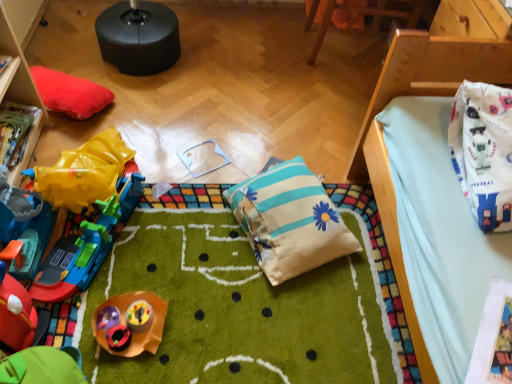
Measure the distance between rubberized yellow toy train at left, positioned as the 3th toy in bottom-to-top order, and camera.

A distance of 3.84 feet exists between rubberized yellow toy train at left, positioned as the 3th toy in bottom-to-top order, and camera.

Describe the element at coordinates (290, 221) in the screenshot. I see `striped cotton pillow at center` at that location.

In order to face white fabric bag at upper right, should I rotate leftwards or rightwards?

To face it directly, rotate right by 31.238 degrees.

Identify the location of white fabric bag at upper right. The width and height of the screenshot is (512, 384). (484, 151).

The height and width of the screenshot is (384, 512). What do you see at coordinates (15, 307) in the screenshot?
I see `rubberized green toy car at lower left, the second toy viewed from the top` at bounding box center [15, 307].

What do you see at coordinates (430, 74) in the screenshot?
I see `white fabric at upper right, positioned as the 3th furniture in left-to-right order` at bounding box center [430, 74].

Where is `wooden toy train at left, marked as the 3th furniture in a right-to-left arrangement`? wooden toy train at left, marked as the 3th furniture in a right-to-left arrangement is located at coordinates [19, 89].

From a real-world perspective, between white fabric at upper right, placed as the first furniture when sorted from right to left, and wooden chair at upper center, the 2th furniture positioned from the left, who is vertically lower?

wooden chair at upper center, the 2th furniture positioned from the left, from a real-world perspective.

Consider the image. Is white fabric at upper right, positioned as the 3th furniture in left-to-right order, oriented towards wooden chair at upper center, the 2th furniture positioned from the left?

Yes, white fabric at upper right, positioned as the 3th furniture in left-to-right order, is facing wooden chair at upper center, the 2th furniture positioned from the left.

Is the depth of white fabric at upper right, placed as the first furniture when sorted from right to left, less than that of wooden chair at upper center, acting as the second furniture starting from the right?

Yes, it is in front of wooden chair at upper center, acting as the second furniture starting from the right.

Does white fabric at upper right, positioned as the 3th furniture in left-to-right order, have a lesser width compared to wooden chair at upper center, the 2th furniture positioned from the left?

In fact, white fabric at upper right, positioned as the 3th furniture in left-to-right order, might be wider than wooden chair at upper center, the 2th furniture positioned from the left.

Locate an element on the screen. The width and height of the screenshot is (512, 384). the 1st furniture counting from the left side of the white fabric bag at upper right is located at coordinates (366, 14).

Consider the image. From the image's perspective, relative to white fabric bag at upper right, is wooden chair at upper center, acting as the second furniture starting from the right, above or below?

Clearly, from the image's perspective, wooden chair at upper center, acting as the second furniture starting from the right, is above white fabric bag at upper right.

Considering the relative sizes of wooden chair at upper center, acting as the second furniture starting from the right, and white fabric bag at upper right in the image provided, is wooden chair at upper center, acting as the second furniture starting from the right, wider than white fabric bag at upper right?

Indeed, wooden chair at upper center, acting as the second furniture starting from the right, has a greater width compared to white fabric bag at upper right.

Do you think wooden chair at upper center, the 2th furniture positioned from the left, is within white fabric bag at upper right, or outside of it?

wooden chair at upper center, the 2th furniture positioned from the left, is not enclosed by white fabric bag at upper right.

Does striped cotton pillow at center come in front of plastic toy at center, marked as the 3th toy in a top-to-bottom arrangement?

No, it is not.

Can you confirm if striped cotton pillow at center is taller than plastic toy at center, marked as the 3th toy in a top-to-bottom arrangement?

Indeed, striped cotton pillow at center has a greater height compared to plastic toy at center, marked as the 3th toy in a top-to-bottom arrangement.

Based on their positions, is striped cotton pillow at center located to the left or right of plastic toy at center, marked as the 3th toy in a top-to-bottom arrangement?

striped cotton pillow at center is positioned on plastic toy at center, marked as the 3th toy in a top-to-bottom arrangement,'s right side.

How far apart are striped cotton pillow at center and plastic toy at center, arranged as the first toy when ordered from the bottom?

They are 19.81 inches apart.

Does wooden chair at upper center, the 2th furniture positioned from the left, come in front of plastic toy at center, arranged as the first toy when ordered from the bottom?

No, it is behind plastic toy at center, arranged as the first toy when ordered from the bottom.

Is wooden chair at upper center, the 2th furniture positioned from the left, to the left of plastic toy at center, arranged as the first toy when ordered from the bottom, from the viewer's perspective?

No.

Considering the relative sizes of wooden chair at upper center, acting as the second furniture starting from the right, and plastic toy at center, arranged as the first toy when ordered from the bottom, in the image provided, is wooden chair at upper center, acting as the second furniture starting from the right, smaller than plastic toy at center, arranged as the first toy when ordered from the bottom,?

Actually, wooden chair at upper center, acting as the second furniture starting from the right, might be larger than plastic toy at center, arranged as the first toy when ordered from the bottom.

Starting from the white fabric at upper right, positioned as the 3th furniture in left-to-right order, which furniture is the 1st one behind? Please provide its 2D coordinates.

[(19, 89)]

Is white fabric at upper right, positioned as the 3th furniture in left-to-right order, oriented towards wooden toy train at left, marked as the 3th furniture in a right-to-left arrangement?

Yes, white fabric at upper right, positioned as the 3th furniture in left-to-right order, is turned towards wooden toy train at left, marked as the 3th furniture in a right-to-left arrangement.

Considering their positions, is white fabric at upper right, positioned as the 3th furniture in left-to-right order, located in front of or behind wooden toy train at left, marked as the 3th furniture in a right-to-left arrangement?

Visually, white fabric at upper right, positioned as the 3th furniture in left-to-right order, is located in front of wooden toy train at left, marked as the 3th furniture in a right-to-left arrangement.

In the scene shown: Is rubberized yellow toy train at left, positioned as the 3th toy in bottom-to-top order, looking in the opposite direction of white fabric bag at upper right?

No, rubberized yellow toy train at left, positioned as the 3th toy in bottom-to-top order, is not facing the opposite direction of white fabric bag at upper right.

From the image's perspective, which is below, rubberized yellow toy train at left, which is the first toy from top to bottom, or white fabric bag at upper right?

rubberized yellow toy train at left, which is the first toy from top to bottom, is shown below in the image.

Considering the relative positions of rubberized yellow toy train at left, which is the first toy from top to bottom, and white fabric bag at upper right in the image provided, is rubberized yellow toy train at left, which is the first toy from top to bottom, to the left of white fabric bag at upper right from the viewer's perspective?

Yes, rubberized yellow toy train at left, which is the first toy from top to bottom, is to the left of white fabric bag at upper right.

Locate an element on the screen. Image resolution: width=512 pixels, height=384 pixels. the 2nd toy behind when counting from the white fabric bag at upper right is located at coordinates (73, 235).

Who is shorter, wooden chair at upper center, acting as the second furniture starting from the right, or rubberized green toy car at lower left, which ranks as the 2th toy in bottom-to-top order?

rubberized green toy car at lower left, which ranks as the 2th toy in bottom-to-top order.

How distant is wooden chair at upper center, the 2th furniture positioned from the left, from rubberized green toy car at lower left, the second toy viewed from the top?

wooden chair at upper center, the 2th furniture positioned from the left, is 6.27 feet away from rubberized green toy car at lower left, the second toy viewed from the top.

Considering the positions of objects wooden chair at upper center, acting as the second furniture starting from the right, and rubberized green toy car at lower left, which ranks as the 2th toy in bottom-to-top order, in the image provided, who is more to the left, wooden chair at upper center, acting as the second furniture starting from the right, or rubberized green toy car at lower left, which ranks as the 2th toy in bottom-to-top order,?

rubberized green toy car at lower left, which ranks as the 2th toy in bottom-to-top order, is more to the left.

Is wooden chair at upper center, the 2th furniture positioned from the left, behind rubberized green toy car at lower left, which ranks as the 2th toy in bottom-to-top order?

Yes, the depth of wooden chair at upper center, the 2th furniture positioned from the left, is greater than that of rubberized green toy car at lower left, which ranks as the 2th toy in bottom-to-top order.

The width and height of the screenshot is (512, 384). I want to click on furniture above the wooden chair at upper center, the 2th furniture positioned from the left (from a real-world perspective), so click(430, 74).

This screenshot has height=384, width=512. Identify the location of the 1st furniture to the left when counting from the white fabric bag at upper right. (366, 14).

From the image, which object appears to be nearer to rubberized green toy car at lower left, the second toy viewed from the top, wooden chair at upper center, acting as the second furniture starting from the right, or plastic toy at center, arranged as the first toy when ordered from the bottom?

plastic toy at center, arranged as the first toy when ordered from the bottom, is closer to rubberized green toy car at lower left, the second toy viewed from the top.

Based on their spatial positions, is rubberized green toy car at lower left, which ranks as the 2th toy in bottom-to-top order, or striped cotton pillow at center closer to plastic toy at center, marked as the 3th toy in a top-to-bottom arrangement?

The object closer to plastic toy at center, marked as the 3th toy in a top-to-bottom arrangement, is rubberized green toy car at lower left, which ranks as the 2th toy in bottom-to-top order.

From the image, which object appears to be farther from wooden toy train at left, marked as the 3th furniture in a right-to-left arrangement, white fabric at upper right, placed as the first furniture when sorted from right to left, or wooden chair at upper center, the 2th furniture positioned from the left?

wooden chair at upper center, the 2th furniture positioned from the left.

From the image, which object appears to be nearer to white fabric at upper right, placed as the first furniture when sorted from right to left, white fabric bag at upper right or striped cotton pillow at center?

white fabric bag at upper right.

Which object lies nearer to the anchor point rubberized yellow toy train at left, which is the first toy from top to bottom, white fabric at upper right, placed as the first furniture when sorted from right to left, or striped cotton pillow at center?

striped cotton pillow at center lies closer to rubberized yellow toy train at left, which is the first toy from top to bottom, than the other object.

From the image, which object appears to be nearer to rubberized yellow toy train at left, which is the first toy from top to bottom, striped cotton pillow at center or rubberized green toy car at lower left, which ranks as the 2th toy in bottom-to-top order?

rubberized green toy car at lower left, which ranks as the 2th toy in bottom-to-top order, is positioned closer to the anchor rubberized yellow toy train at left, which is the first toy from top to bottom.

Which object lies nearer to the anchor point striped cotton pillow at center, plastic toy at center, arranged as the first toy when ordered from the bottom, or rubberized green toy car at lower left, the second toy viewed from the top?

plastic toy at center, arranged as the first toy when ordered from the bottom, lies closer to striped cotton pillow at center than the other object.

When comparing their distances from rubberized green toy car at lower left, which ranks as the 2th toy in bottom-to-top order, does wooden chair at upper center, acting as the second furniture starting from the right, or striped cotton pillow at center seem closer?

The object closer to rubberized green toy car at lower left, which ranks as the 2th toy in bottom-to-top order, is striped cotton pillow at center.

Image resolution: width=512 pixels, height=384 pixels. What are the coordinates of `pillow between wooden chair at upper center, the 2th furniture positioned from the left, and rubberized green toy car at lower left, the second toy viewed from the top, vertically` in the screenshot? It's located at (290, 221).

Locate an element on the screen. This screenshot has width=512, height=384. pillow between wooden chair at upper center, acting as the second furniture starting from the right, and plastic toy at center, arranged as the first toy when ordered from the bottom, in the vertical direction is located at coordinates (290, 221).

Find the location of a particular element. This screenshot has height=384, width=512. furniture between rubberized green toy car at lower left, which ranks as the 2th toy in bottom-to-top order, and white fabric bag at upper right is located at coordinates (366, 14).

The width and height of the screenshot is (512, 384). In order to click on pillow situated between wooden toy train at left, which appears as the 1th furniture when viewed from the left, and white fabric at upper right, placed as the first furniture when sorted from right to left, from left to right in this screenshot , I will do `click(290, 221)`.